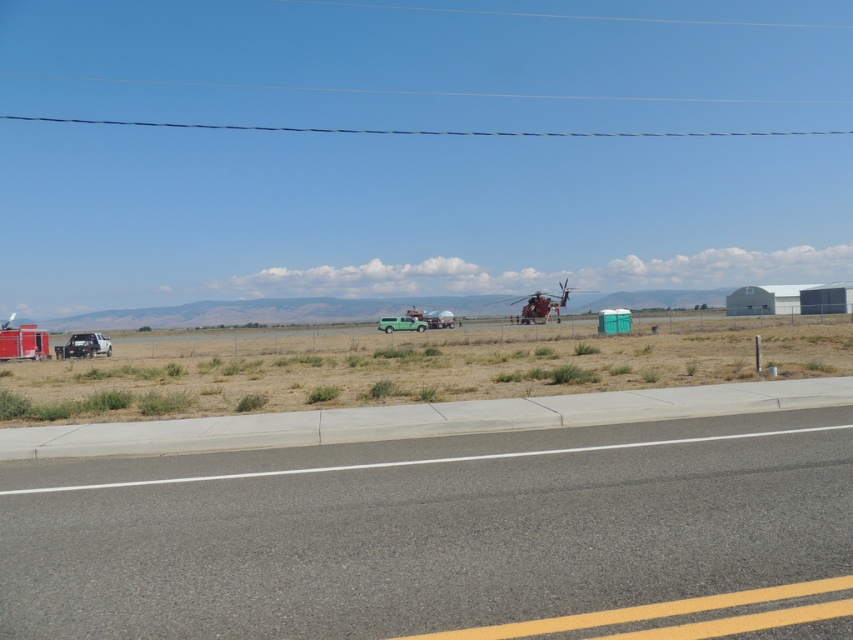
Question: In this image, where is green matte truck at lower left located relative to matte black truck at left?

Choices:
 (A) above
 (B) below

Answer: (A)

Question: Estimate the real-world distances between objects in this image. Which object is closer to the metallic silver trailer truck at left?

Choices:
 (A) matte black truck at left
 (B) asphalt road at center

Answer: (A)

Question: Can you confirm if metallic silver trailer truck at left is smaller than green matte van at center?

Choices:
 (A) yes
 (B) no

Answer: (B)

Question: Which point is farther to the camera?

Choices:
 (A) green matte van at center
 (B) green matte truck at lower left
 (C) matte black truck at left
 (D) asphalt road at center

Answer: (A)

Question: Which of the following is the farthest from the observer?

Choices:
 (A) matte black truck at left
 (B) metallic silver trailer truck at left
 (C) green matte truck at lower left
 (D) green matte van at center

Answer: (D)

Question: Can you confirm if matte black truck at left is smaller than green matte van at center?

Choices:
 (A) yes
 (B) no

Answer: (A)